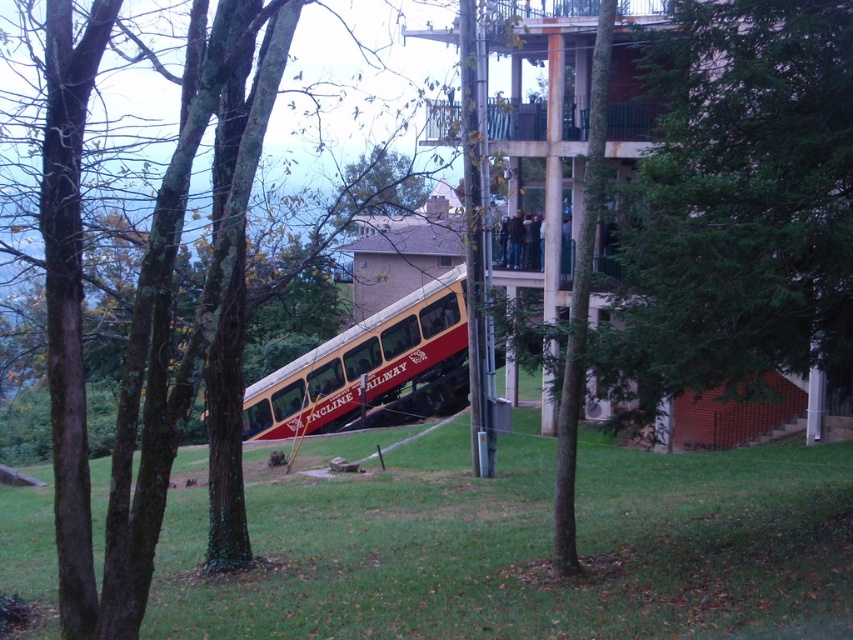
You are a photographer planning to capture the red polished wood passenger train at center and the green bark tree at center in the same frame. Based on their sizes, which object should you focus on first to ensure both fit in the shot?

The green bark tree at center is thinner than the red polished wood passenger train at center, so you should focus on the red polished wood passenger train at center first to accommodate its larger size in the frame.

You are standing at the point marked as point (x=138, y=296). What can you see directly in front of you?

At point 0.464, 0.164 lies green bark tree at center.

Consider the image. You are standing at the base of the inclined railway and want to take a photo that includes both the vibrant red and cream railway car and the building in the background. Which point, point (163, 481) or point (396, 369), should you focus on to ensure both the railway car and the building are in focus?

You should focus on point (396, 369) because it is farther from the camera than point (163, 481), allowing both the railway car and the building to be in focus.